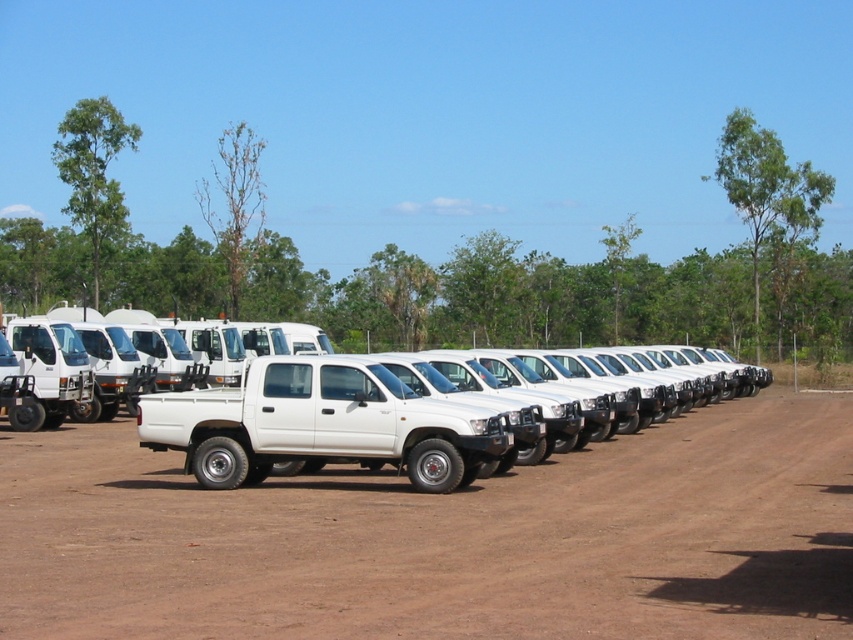
You are standing in front of the brown dirt field at center and want to reach the white matte pickup truck at center. Which direction should you move to get closer to the truck?

Since the brown dirt field at center is closer to the viewer than the white matte pickup truck at center, you should move forward towards the truck to get closer.

Consider the image. You are standing at the edge of the brown dirt field at center and want to get to the white matte pickup truck at center. Which direction should you move to reach the truck?

The brown dirt field at center is located below the white matte pickup truck at center, so you should move upward to reach the truck.